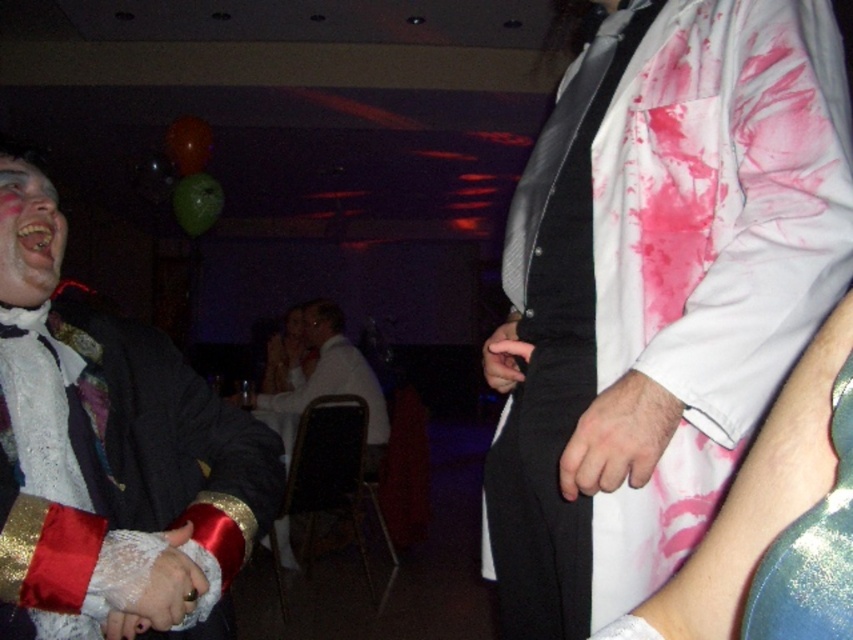
Question: Which point appears farthest from the camera in this image?

Choices:
 (A) (326, 314)
 (B) (62, 218)

Answer: (A)

Question: Can you confirm if white satin shirt at center is positioned above black leather glove at center?

Choices:
 (A) yes
 (B) no

Answer: (B)

Question: Which point appears farthest from the camera in this image?

Choices:
 (A) (312, 316)
 (B) (9, 532)
 (C) (520, 355)

Answer: (A)

Question: Is white glossy shirt at center wider than white satin shirt at center?

Choices:
 (A) no
 (B) yes

Answer: (A)

Question: Does white lace glove at left appear under white matte face at left?

Choices:
 (A) yes
 (B) no

Answer: (A)

Question: Which point is closer to the camera taking this photo?

Choices:
 (A) tap(170, 580)
 (B) tap(606, 220)
 (C) tap(16, 163)
 (D) tap(576, 480)

Answer: (D)